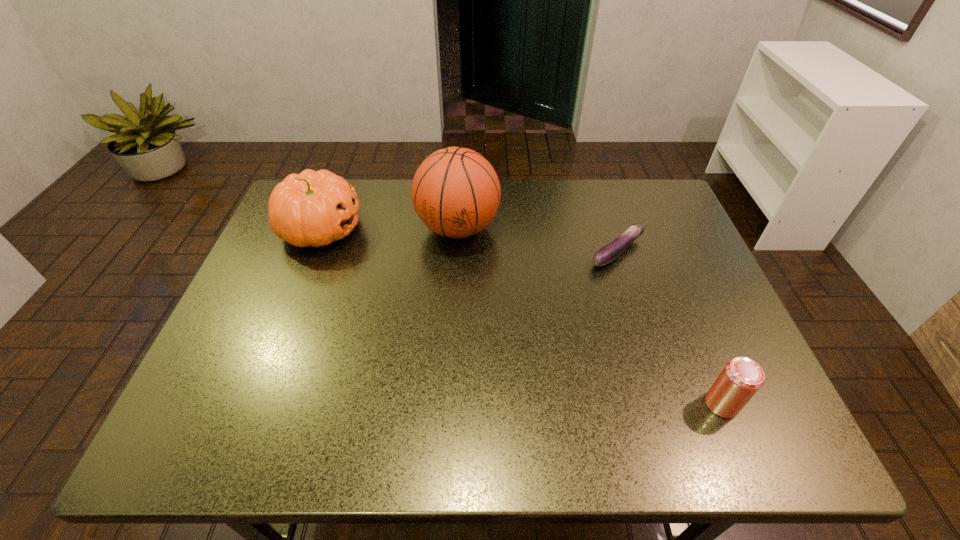
Locate an element on the screen. This screenshot has height=540, width=960. the tallest object is located at coordinates (455, 192).

The image size is (960, 540). Identify the location of basketball. (455, 192).

Identify the location of the leftmost object. (313, 208).

Locate an element on the screen. This screenshot has width=960, height=540. the second tallest object is located at coordinates (313, 208).

The image size is (960, 540). I want to click on the third tallest object, so click(x=741, y=378).

Find the location of a particular element. beer can is located at coordinates (741, 378).

I want to click on eggplant, so click(x=608, y=253).

Locate an element on the screen. Image resolution: width=960 pixels, height=540 pixels. free space located 0.130m on the right of the third object from right to left is located at coordinates (544, 228).

The width and height of the screenshot is (960, 540). I want to click on free space located on the carved face of the second tallest object, so click(x=426, y=228).

You are a GUI agent. You are given a task and a screenshot of the screen. Output one action in this format:
    pyautogui.click(x=<x>, y=<y>)
    Task: Click on the free location located 0.120m on the back of the beer can
    This screenshot has width=960, height=540.
    Given the screenshot: What is the action you would take?
    pyautogui.click(x=696, y=342)